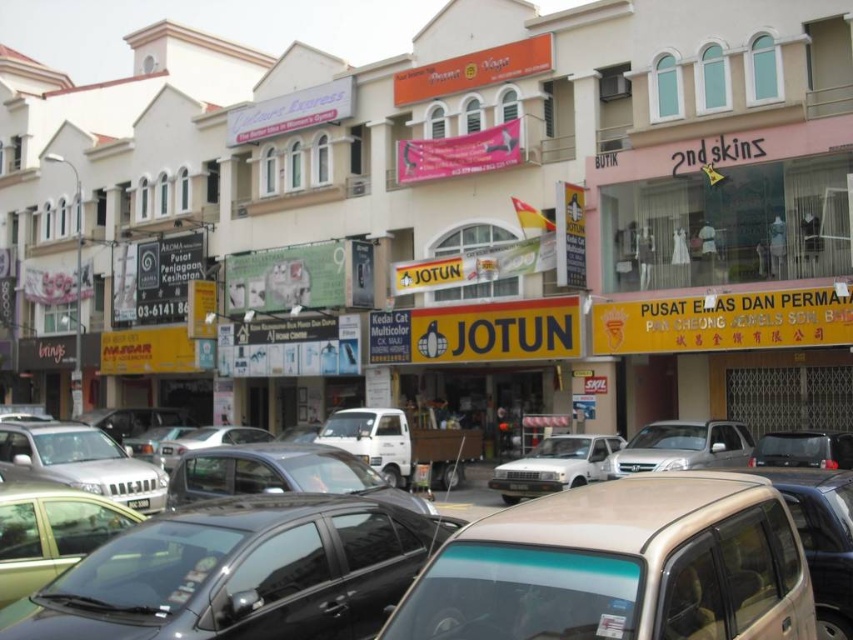
Who is higher up, metallic silver car at center or satin beige car at center?

Positioned higher is metallic silver car at center.

Looking at this image, how distant is metallic silver car at center from satin beige car at center?

The distance of metallic silver car at center from satin beige car at center is 7.95 centimeters.

Is point (294, 632) farther from viewer compared to point (695, 538)?

Yes.

Find the location of a particular element. The image size is (853, 640). metallic silver car at center is located at coordinates (433, 572).

Where is `satin beige car at center`? satin beige car at center is located at coordinates (619, 566).

Looking at this image, is the position of satin beige car at center more distant than that of silver metallic car at center?

No, satin beige car at center is closer to the viewer.

Does point (669, 608) come closer to viewer compared to point (705, 445)?

Yes, point (669, 608) is closer to viewer.

Identify the location of satin beige car at center. The image size is (853, 640). (619, 566).

Which is below, metallic silver car at center or black plastic license plate at center?

black plastic license plate at center is lower down.

Who is taller, metallic silver car at center or black plastic license plate at center?

With more height is metallic silver car at center.

Identify the location of metallic silver car at center. This screenshot has width=853, height=640. (433, 572).